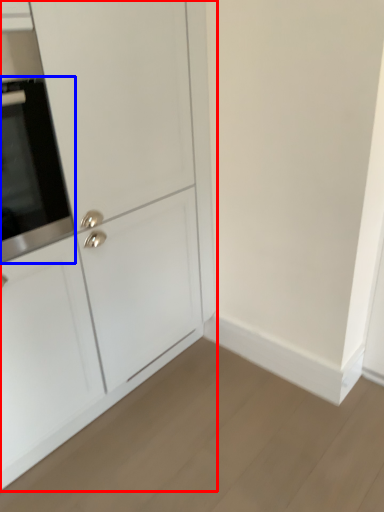
Question: Which of the following is the closest to the observer, cabinetry (highlighted by a red box) or oven (highlighted by a blue box)?

Choices:
 (A) cabinetry
 (B) oven

Answer: (A)